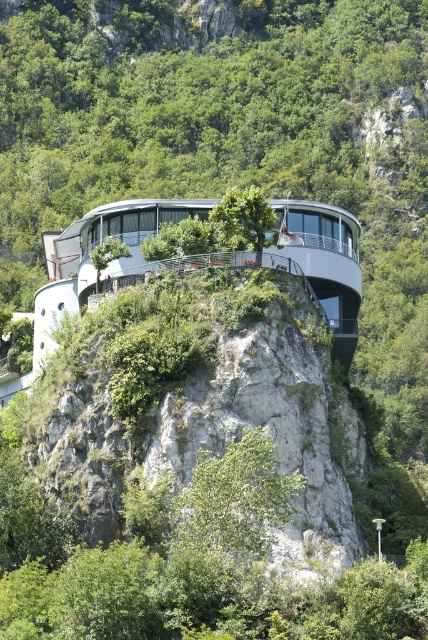
Does point (303, 516) lie behind point (219, 204)?

No, it is in front of (219, 204).

Who is higher up, white stone cliff at center or green leafy tree at center?

green leafy tree at center

Between point (288, 358) and point (265, 241), which one is positioned behind?

Positioned behind is point (265, 241).

Find the location of a particular element. The width and height of the screenshot is (428, 640). white stone cliff at center is located at coordinates (199, 403).